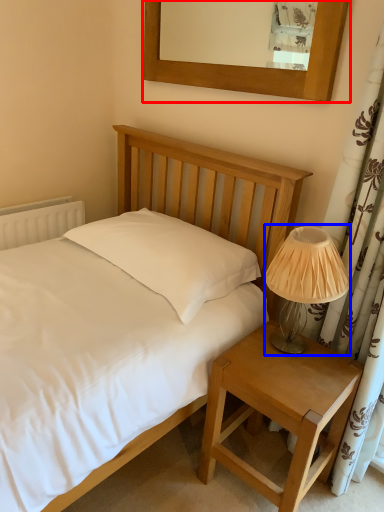
Question: Among these objects, which one is farthest to the camera, picture frame (highlighted by a red box) or table lamp (highlighted by a blue box)?

Choices:
 (A) picture frame
 (B) table lamp

Answer: (A)